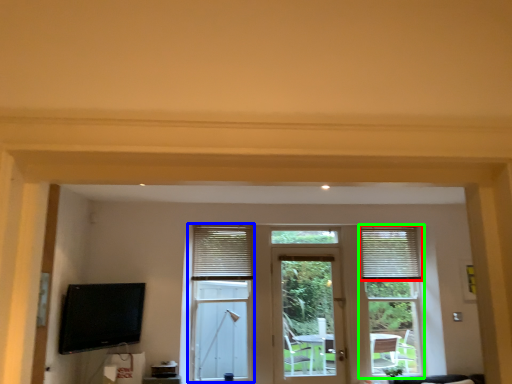
Question: Which object is positioned farthest from window blind (highlighted by a red box)? Select from bay window (highlighted by a blue box) and window frame (highlighted by a green box).

Choices:
 (A) bay window
 (B) window frame

Answer: (A)